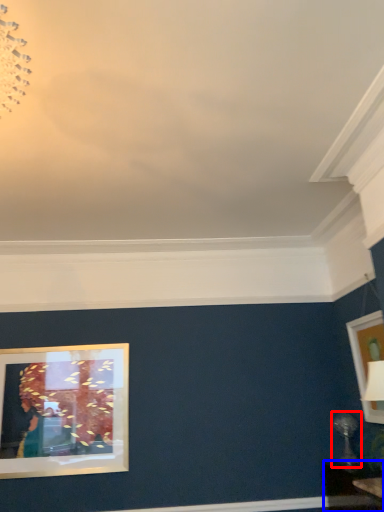
Question: Which of the following is the closest to the observer, table lamp (highlighted by a red box) or table (highlighted by a blue box)?

Choices:
 (A) table lamp
 (B) table

Answer: (B)